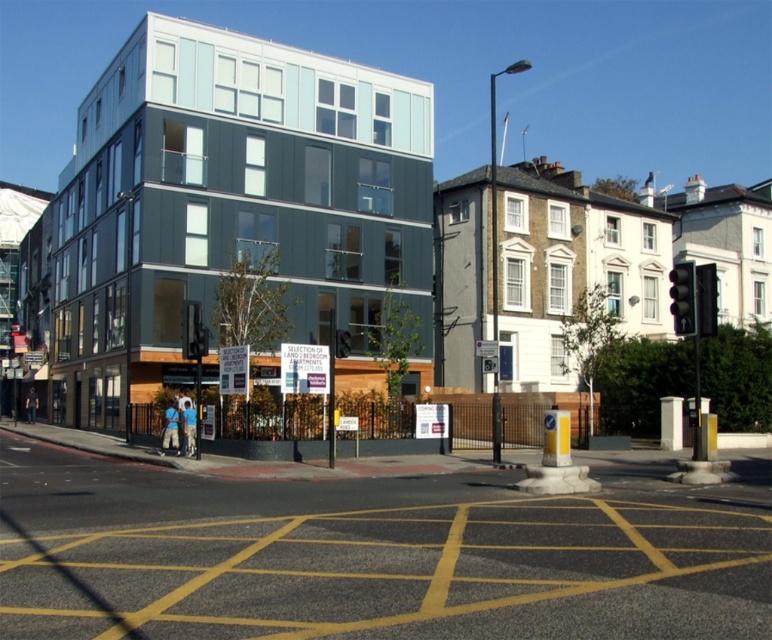
Question: In this image, where is metallic traffic light at right located relative to black plastic traffic light at right?

Choices:
 (A) below
 (B) above

Answer: (A)

Question: Among these objects, which one is farthest from the camera?

Choices:
 (A) metallic traffic light at right
 (B) black plastic traffic light at right

Answer: (A)

Question: Does metallic traffic light at right come behind black plastic traffic light at right?

Choices:
 (A) no
 (B) yes

Answer: (B)

Question: Which point is closer to the camera?

Choices:
 (A) black plastic traffic light at right
 (B) metallic traffic light at right

Answer: (A)

Question: Does metallic traffic light at right have a larger size compared to black plastic traffic light at right?

Choices:
 (A) no
 (B) yes

Answer: (A)